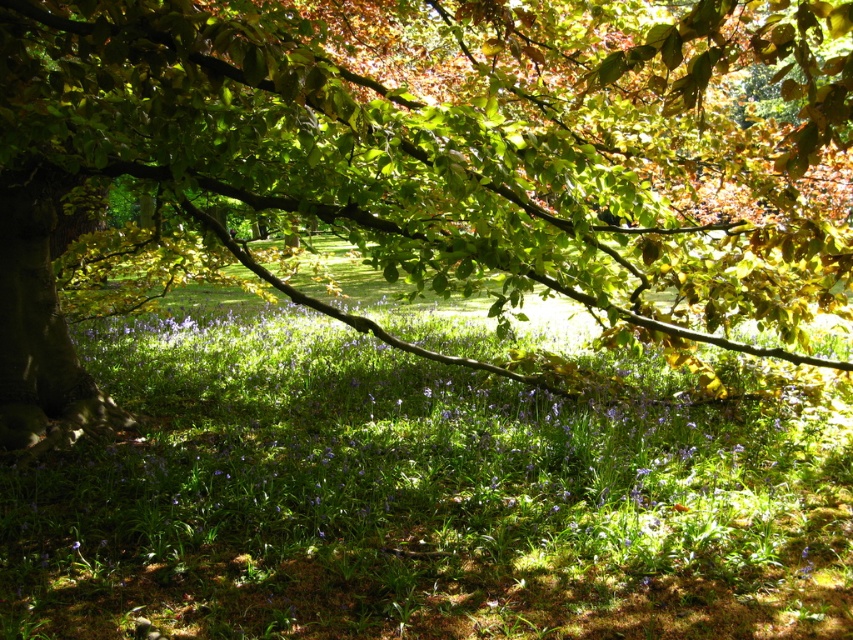
Who is taller, green leafy tree at upper left or green leafy grass at center?

green leafy tree at upper left

Who is more distant from viewer, (703, 305) or (688, 408)?

Positioned behind is point (688, 408).

This screenshot has width=853, height=640. Identify the location of green leafy tree at upper left. (431, 161).